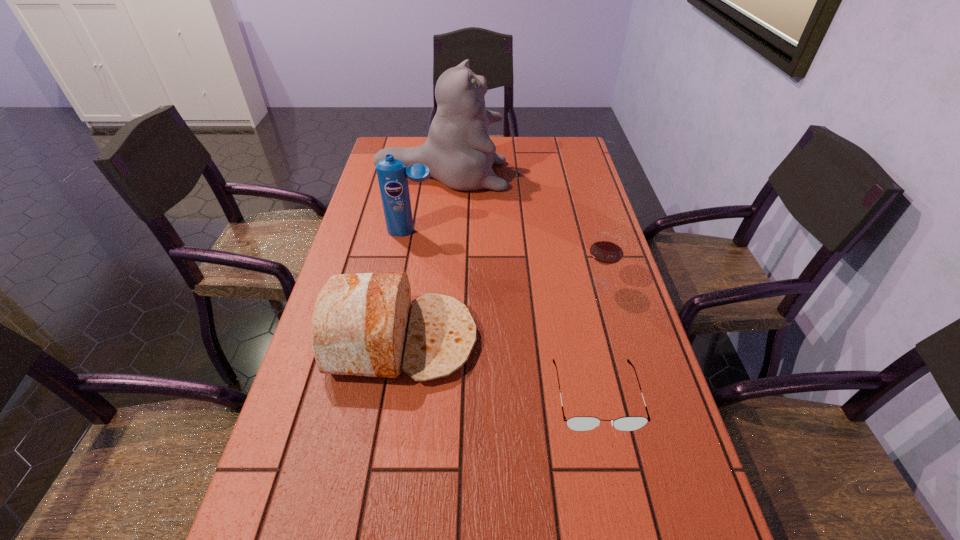
Locate an element on the screen. vacant space located 0.390m on the front of the wineglass is located at coordinates (640, 441).

The width and height of the screenshot is (960, 540). I want to click on free point located 0.150m on the lenses of the spectacles, so click(621, 515).

Where is `object that is at the far edge`? The width and height of the screenshot is (960, 540). object that is at the far edge is located at coordinates (459, 153).

Where is `cat situated at the left edge`? Image resolution: width=960 pixels, height=540 pixels. cat situated at the left edge is located at coordinates (459, 153).

Where is `shampoo present at the left edge`? The height and width of the screenshot is (540, 960). shampoo present at the left edge is located at coordinates (392, 174).

Locate an element on the screen. The width and height of the screenshot is (960, 540). bread that is at the left edge is located at coordinates (364, 324).

I want to click on wineglass present at the right edge, so pos(607,248).

Where is `spectacles that is at the right edge`? The height and width of the screenshot is (540, 960). spectacles that is at the right edge is located at coordinates (579, 423).

Locate an element on the screen. Image resolution: width=960 pixels, height=540 pixels. object at the far left corner is located at coordinates (459, 153).

This screenshot has width=960, height=540. In the image, there is a desktop. Find the location of `free space at the left edge`. free space at the left edge is located at coordinates (313, 525).